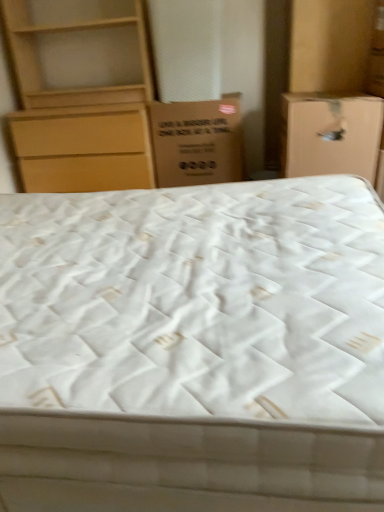
Identify the location of brown cardboard box at center, which is the second cardboard box from right to left. (197, 142).

You are a GUI agent. You are given a task and a screenshot of the screen. Output one action in this format:
    pyautogui.click(x=<x>, y=<y>)
    Task: Click on the matte cardboard box at right, the 1th cardboard box viewed from the right
    The image size is (384, 512).
    Given the screenshot: What is the action you would take?
    [x=330, y=134]

The width and height of the screenshot is (384, 512). I want to click on white quilted mattress at center, so click(193, 348).

The width and height of the screenshot is (384, 512). What do you see at coordinates (193, 348) in the screenshot?
I see `white quilted mattress at center` at bounding box center [193, 348].

The image size is (384, 512). I want to click on brown cardboard box at center, which is the second cardboard box from right to left, so click(x=197, y=142).

Which object is positioned more to the left, matte wood chest of drawers at upper left or white quilted mattress at center?

matte wood chest of drawers at upper left is more to the left.

Does point (82, 79) come closer to viewer compared to point (304, 369)?

No, it is not.

From a real-world perspective, who is located lower, matte wood chest of drawers at upper left or white quilted mattress at center?

From a 3D spatial view, white quilted mattress at center is below.

Is white quilted mattress at center inside the boundaries of matte wood chest of drawers at upper left, or outside?

The correct answer is: outside.

From the image's perspective, between white quilted mattress at center and matte wood chest of drawers at upper left, who is located below?

white quilted mattress at center appears lower in the image.

Which of these two, white quilted mattress at center or matte wood chest of drawers at upper left, is wider?

white quilted mattress at center.

Can you see white quilted mattress at center touching matte wood chest of drawers at upper left?

They are not placed beside each other.

Where is `cardboard box that is the 1st one when counting rightward from the matte wood chest of drawers at upper left`? cardboard box that is the 1st one when counting rightward from the matte wood chest of drawers at upper left is located at coordinates (197, 142).

Based on the photo, who is smaller, matte wood chest of drawers at upper left or brown cardboard box at center, which appears as the 1th cardboard box when viewed from the left?

brown cardboard box at center, which appears as the 1th cardboard box when viewed from the left.

Who is taller, matte wood chest of drawers at upper left or brown cardboard box at center, which is the second cardboard box from right to left?

With more height is matte wood chest of drawers at upper left.

Can you tell me how much matte wood chest of drawers at upper left and brown cardboard box at center, which is the second cardboard box from right to left, differ in facing direction?

They differ by 1.47 degrees in their facing directions.

Is there a large distance between white quilted mattress at center and matte cardboard box at right, the 1th cardboard box viewed from the right?

Yes.

Based on their sizes in the image, would you say white quilted mattress at center is bigger or smaller than matte cardboard box at right, which is the second cardboard box in left-to-right order?

white quilted mattress at center is bigger than matte cardboard box at right, which is the second cardboard box in left-to-right order.

From the image's perspective, is white quilted mattress at center over matte cardboard box at right, the 1th cardboard box viewed from the right?

Actually, white quilted mattress at center appears below matte cardboard box at right, the 1th cardboard box viewed from the right, in the image.

Looking at this image, considering the sizes of white quilted mattress at center and matte cardboard box at right, which is the second cardboard box in left-to-right order, in the image, is white quilted mattress at center wider or thinner than matte cardboard box at right, which is the second cardboard box in left-to-right order,?

Considering their sizes, white quilted mattress at center looks broader than matte cardboard box at right, which is the second cardboard box in left-to-right order.

From the image's perspective, which one is positioned lower, matte cardboard box at right, which is the second cardboard box in left-to-right order, or matte wood chest of drawers at upper left?

matte cardboard box at right, which is the second cardboard box in left-to-right order, appears lower in the image.

Is matte cardboard box at right, which is the second cardboard box in left-to-right order, next to matte wood chest of drawers at upper left?

No, matte cardboard box at right, which is the second cardboard box in left-to-right order, is not beside matte wood chest of drawers at upper left.

Could you tell me if matte cardboard box at right, which is the second cardboard box in left-to-right order, is facing matte wood chest of drawers at upper left?

No.

Between matte cardboard box at right, the 1th cardboard box viewed from the right, and matte wood chest of drawers at upper left, which one appears on the right side from the viewer's perspective?

From the viewer's perspective, matte cardboard box at right, the 1th cardboard box viewed from the right, appears more on the right side.

From a real-world perspective, relative to white quilted mattress at center, is brown cardboard box at center, which is the second cardboard box from right to left, vertically above or below?

From a real-world perspective, brown cardboard box at center, which is the second cardboard box from right to left, is physically above white quilted mattress at center.

Considering the relative sizes of brown cardboard box at center, which is the second cardboard box from right to left, and white quilted mattress at center in the image provided, is brown cardboard box at center, which is the second cardboard box from right to left, taller than white quilted mattress at center?

Yes.

Are brown cardboard box at center, which is the second cardboard box from right to left, and white quilted mattress at center far apart?

Absolutely, brown cardboard box at center, which is the second cardboard box from right to left, is distant from white quilted mattress at center.

Which object is thinner, brown cardboard box at center, which is the second cardboard box from right to left, or white quilted mattress at center?

With smaller width is brown cardboard box at center, which is the second cardboard box from right to left.

Which is in front, point (184, 170) or point (312, 160)?

The point (312, 160) is in front.

Is brown cardboard box at center, which is the second cardboard box from right to left, oriented towards matte cardboard box at right, which is the second cardboard box in left-to-right order?

No, brown cardboard box at center, which is the second cardboard box from right to left, is not facing towards matte cardboard box at right, which is the second cardboard box in left-to-right order.

Locate an element on the screen. Image resolution: width=384 pixels, height=512 pixels. cardboard box in front of the brown cardboard box at center, which appears as the 1th cardboard box when viewed from the left is located at coordinates (330, 134).

Is brown cardboard box at center, which is the second cardboard box from right to left, taller than matte cardboard box at right, which is the second cardboard box in left-to-right order?

Indeed, brown cardboard box at center, which is the second cardboard box from right to left, has a greater height compared to matte cardboard box at right, which is the second cardboard box in left-to-right order.

Locate an element on the screen. Image resolution: width=384 pixels, height=512 pixels. the chest of drawers lying above the white quilted mattress at center (from the image's perspective) is located at coordinates (81, 98).

In order to click on chest of drawers behind the white quilted mattress at center in this screenshot , I will do coord(81,98).

When comparing their distances from brown cardboard box at center, which is the second cardboard box from right to left, does white quilted mattress at center or matte wood chest of drawers at upper left seem further?

Among the two, white quilted mattress at center is located further to brown cardboard box at center, which is the second cardboard box from right to left.

From the image, which object appears to be nearer to white quilted mattress at center, matte wood chest of drawers at upper left or brown cardboard box at center, which appears as the 1th cardboard box when viewed from the left?

The object closer to white quilted mattress at center is brown cardboard box at center, which appears as the 1th cardboard box when viewed from the left.

From the image, which object appears to be nearer to matte wood chest of drawers at upper left, white quilted mattress at center or brown cardboard box at center, which appears as the 1th cardboard box when viewed from the left?

brown cardboard box at center, which appears as the 1th cardboard box when viewed from the left, is closer to matte wood chest of drawers at upper left.

Based on their spatial positions, is matte wood chest of drawers at upper left or white quilted mattress at center further from brown cardboard box at center, which appears as the 1th cardboard box when viewed from the left?

The object further to brown cardboard box at center, which appears as the 1th cardboard box when viewed from the left, is white quilted mattress at center.

From the image, which object appears to be farther from white quilted mattress at center, brown cardboard box at center, which is the second cardboard box from right to left, or matte cardboard box at right, the 1th cardboard box viewed from the right?

brown cardboard box at center, which is the second cardboard box from right to left, is positioned further to the anchor white quilted mattress at center.

When comparing their distances from white quilted mattress at center, does matte cardboard box at right, which is the second cardboard box in left-to-right order, or brown cardboard box at center, which is the second cardboard box from right to left, seem closer?

matte cardboard box at right, which is the second cardboard box in left-to-right order.

From the image, which object appears to be farther from matte wood chest of drawers at upper left, brown cardboard box at center, which appears as the 1th cardboard box when viewed from the left, or white quilted mattress at center?

Among the two, white quilted mattress at center is located further to matte wood chest of drawers at upper left.

Estimate the real-world distances between objects in this image. Which object is closer to brown cardboard box at center, which is the second cardboard box from right to left, matte cardboard box at right, which is the second cardboard box in left-to-right order, or white quilted mattress at center?

matte cardboard box at right, which is the second cardboard box in left-to-right order, is positioned closer to the anchor brown cardboard box at center, which is the second cardboard box from right to left.

Where is `cardboard box situated between matte wood chest of drawers at upper left and matte cardboard box at right, the 1th cardboard box viewed from the right, from left to right`? Image resolution: width=384 pixels, height=512 pixels. cardboard box situated between matte wood chest of drawers at upper left and matte cardboard box at right, the 1th cardboard box viewed from the right, from left to right is located at coordinates (197, 142).

Where is `cardboard box positioned between white quilted mattress at center and brown cardboard box at center, which appears as the 1th cardboard box when viewed from the left, from near to far`? cardboard box positioned between white quilted mattress at center and brown cardboard box at center, which appears as the 1th cardboard box when viewed from the left, from near to far is located at coordinates (330, 134).

Image resolution: width=384 pixels, height=512 pixels. In order to click on chest of drawers between white quilted mattress at center and brown cardboard box at center, which appears as the 1th cardboard box when viewed from the left, from front to back in this screenshot , I will do `click(81, 98)`.

Find the location of a particular element. The image size is (384, 512). cardboard box positioned between white quilted mattress at center and matte wood chest of drawers at upper left from near to far is located at coordinates (330, 134).